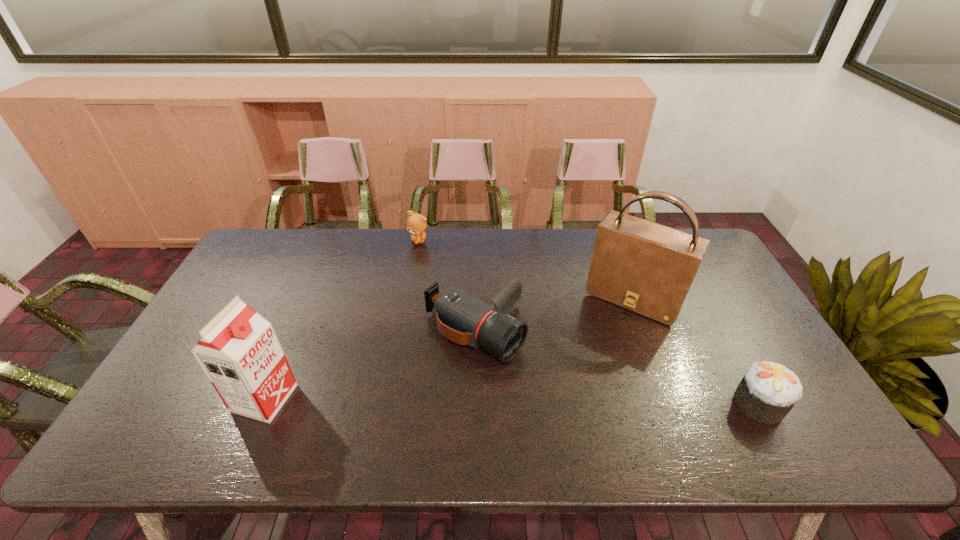
Where is `free space between the shoulder bag and the third object from left to right`? This screenshot has width=960, height=540. free space between the shoulder bag and the third object from left to right is located at coordinates (554, 316).

The width and height of the screenshot is (960, 540). In order to click on empty space that is in between the teddy bear and the rightmost object in this screenshot , I will do `click(589, 322)`.

You are a GUI agent. You are given a task and a screenshot of the screen. Output one action in this format:
    pyautogui.click(x=<x>, y=<y>)
    Task: Click on the vacant space that's between the fourth object from left to right and the camcorder
    The width and height of the screenshot is (960, 540).
    Given the screenshot: What is the action you would take?
    pyautogui.click(x=554, y=316)

At what (x,y) coordinates should I click in order to perform the action: click on free space between the rightmost object and the second object from right to left. Please return your answer as a coordinate pair (x, y). This screenshot has height=540, width=960. Looking at the image, I should click on (697, 350).

Image resolution: width=960 pixels, height=540 pixels. I want to click on vacant region between the fourth shortest object and the rightmost object, so click(512, 401).

At what (x,y) coordinates should I click in order to perform the action: click on vacant space in between the teddy bear and the fourth shortest object. Please return your answer as a coordinate pair (x, y). Looking at the image, I should click on (342, 319).

Image resolution: width=960 pixels, height=540 pixels. I want to click on free spot between the second object from right to left and the second tallest object, so click(449, 347).

Locate an element on the screen. The image size is (960, 540). vacant space in between the third object from left to right and the fourth object from right to left is located at coordinates (446, 288).

Find the location of a particular element. This screenshot has height=540, width=960. empty location between the leftmost object and the third object from left to right is located at coordinates (370, 366).

Where is `free space between the rightmost object and the farthest object`? free space between the rightmost object and the farthest object is located at coordinates (589, 322).